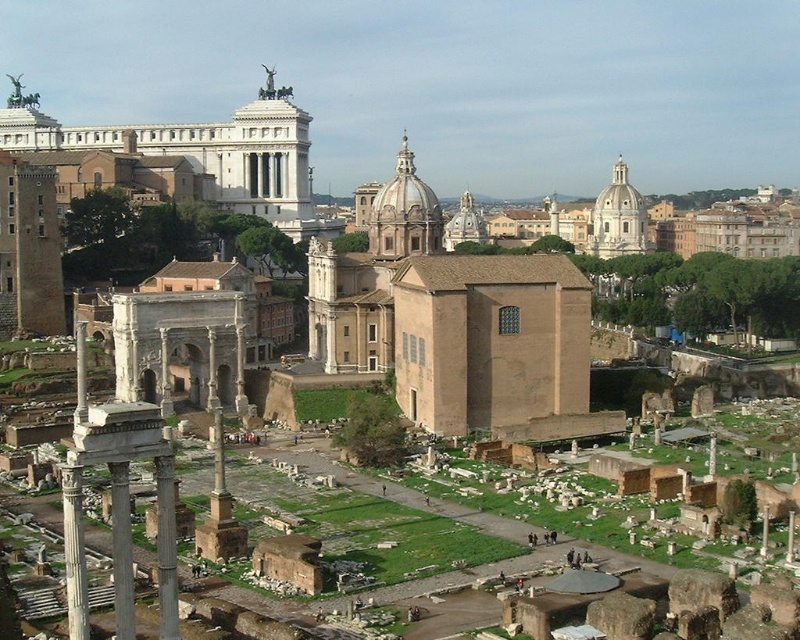
You are standing at the Roman Forum and want to take a photo of the smooth stone column at left. If your camera has a maximum focus range of 200 feet, will you be able to capture the column clearly?

The smooth stone column at left is 216.81 feet away from the viewer. Since this distance exceeds the camera maximum focus range of 200 feet, the column will be out of focus and cannot be captured clearly.

Consider the image. You are a tourist standing at the Roman Forum and see the white marble pillar at lower left and the white marble pillar at center. Which pillar is taller?

The white marble pillar at lower left is taller than the white marble pillar at center.

In the scene shown: You are standing at the center of the Roman Forum and want to take a photo of the white marble pillar at lower left. According to the coordinates provided, where should you position yourself to capture the pillar in your shot?

The white marble pillar at lower left is located at point coordinates of [121,552], so you should position yourself facing the lower left direction to include the pillar in your photo.